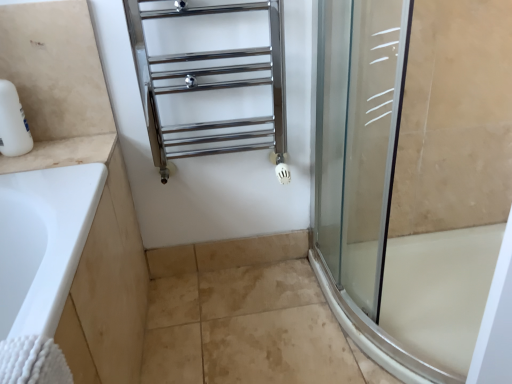
This screenshot has height=384, width=512. What do you see at coordinates (211, 79) in the screenshot?
I see `polished chrome towel rack at upper center` at bounding box center [211, 79].

What do you see at coordinates (62, 153) in the screenshot?
I see `white marble counter at left` at bounding box center [62, 153].

Locate an element on the screen. beige tile at lower center is located at coordinates (251, 250).

Where is `tile below the white marble counter at left (from the image's perspective)`? This screenshot has height=384, width=512. tile below the white marble counter at left (from the image's perspective) is located at coordinates (251, 250).

How many degrees apart are the facing directions of white marble counter at left and beige tile at lower center?

0.0248 degrees separate the facing orientations of white marble counter at left and beige tile at lower center.

Is beige tile at lower center a part of white marble counter at left?

No, beige tile at lower center is not surrounded by white marble counter at left.

How far apart are white marble counter at left and beige tile at lower center?

They are 23.18 inches apart.

From a real-world perspective, is white marble counter at left physically above polished chrome towel rack at upper center?

Incorrect, from a real-world perspective, white marble counter at left is lower than polished chrome towel rack at upper center.

Is polished chrome towel rack at upper center at the back of white marble counter at left?

No, white marble counter at left's orientation is not away from polished chrome towel rack at upper center.

In the scene shown: Would you say white marble counter at left is outside polished chrome towel rack at upper center?

white marble counter at left lies outside polished chrome towel rack at upper center's area.

Considering the sizes of objects beige tile at lower center and polished chrome towel rack at upper center in the image provided, who is wider, beige tile at lower center or polished chrome towel rack at upper center?

polished chrome towel rack at upper center.

Is polished chrome towel rack at upper center at the back of beige tile at lower center?

No.

Considering the sizes of objects beige tile at lower center and polished chrome towel rack at upper center in the image provided, who is shorter, beige tile at lower center or polished chrome towel rack at upper center?

beige tile at lower center.

From a real-world perspective, is beige tile at lower center physically below polished chrome towel rack at upper center?

Result: Yes, from a real-world perspective, beige tile at lower center is beneath polished chrome towel rack at upper center.

At what (x,y) coordinates should I click in order to perform the action: click on counter top on the left of beige tile at lower center. Please return your answer as a coordinate pair (x, y). This screenshot has width=512, height=384. Looking at the image, I should click on (62, 153).

In the scene shown: Considering the sizes of objects beige tile at lower center and white marble counter at left in the image provided, who is wider, beige tile at lower center or white marble counter at left?

With larger width is white marble counter at left.

Which object is positioned more to the right, beige tile at lower center or white marble counter at left?

Positioned to the right is beige tile at lower center.

Is beige tile at lower center inside or outside of white marble counter at left?

beige tile at lower center is located beyond the bounds of white marble counter at left.

Between polished chrome towel rack at upper center and white marble counter at left, which one is positioned behind?

white marble counter at left is more distant.

Is polished chrome towel rack at upper center next to white marble counter at left?

No, polished chrome towel rack at upper center is not touching white marble counter at left.

Which object is wider, polished chrome towel rack at upper center or white marble counter at left?

white marble counter at left.

Is white marble counter at left surrounded by polished chrome towel rack at upper center?

No.

How many degrees apart are the facing directions of polished chrome towel rack at upper center and beige tile at lower center?

The facing directions of polished chrome towel rack at upper center and beige tile at lower center are 1.04 degrees apart.

Is polished chrome towel rack at upper center positioned with its back to beige tile at lower center?

polished chrome towel rack at upper center does not have its back to beige tile at lower center.

Does polished chrome towel rack at upper center have a larger size compared to beige tile at lower center?

Indeed, polished chrome towel rack at upper center has a larger size compared to beige tile at lower center.

From their relative heights in the image, would you say polished chrome towel rack at upper center is taller or shorter than beige tile at lower center?

Considering their sizes, polished chrome towel rack at upper center has more height than beige tile at lower center.

The image size is (512, 384). Find the location of `counter top in front of the beige tile at lower center`. counter top in front of the beige tile at lower center is located at coordinates (62, 153).

Find the location of a particular element. The height and width of the screenshot is (384, 512). shelf to the right of white marble counter at left is located at coordinates (211, 79).

Estimate the real-world distances between objects in this image. Which object is closer to beige tile at lower center, polished chrome towel rack at upper center or white marble counter at left?

polished chrome towel rack at upper center lies closer to beige tile at lower center than the other object.

When comparing their distances from white marble counter at left, does polished chrome towel rack at upper center or beige tile at lower center seem further?

Among the two, beige tile at lower center is located further to white marble counter at left.

Based on their spatial positions, is beige tile at lower center or white marble counter at left closer to polished chrome towel rack at upper center?

white marble counter at left.

Estimate the real-world distances between objects in this image. Which object is further from white marble counter at left, beige tile at lower center or polished chrome towel rack at upper center?

The object further to white marble counter at left is beige tile at lower center.

Based on their spatial positions, is white marble counter at left or polished chrome towel rack at upper center closer to beige tile at lower center?

polished chrome towel rack at upper center.

Considering their positions, is white marble counter at left positioned closer to polished chrome towel rack at upper center than beige tile at lower center?

white marble counter at left is positioned closer to the anchor polished chrome towel rack at upper center.

The height and width of the screenshot is (384, 512). Identify the location of counter top located between polished chrome towel rack at upper center and beige tile at lower center in the depth direction. (62, 153).